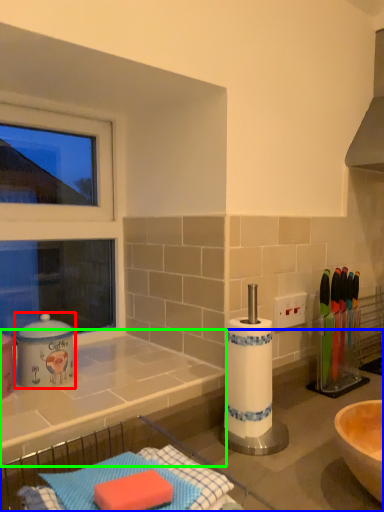
Question: Based on their relative distances, which object is farther from appliance (highlighted by a red box)? Choose from countertop (highlighted by a blue box) and countertop (highlighted by a green box).

Choices:
 (A) countertop
 (B) countertop

Answer: (A)